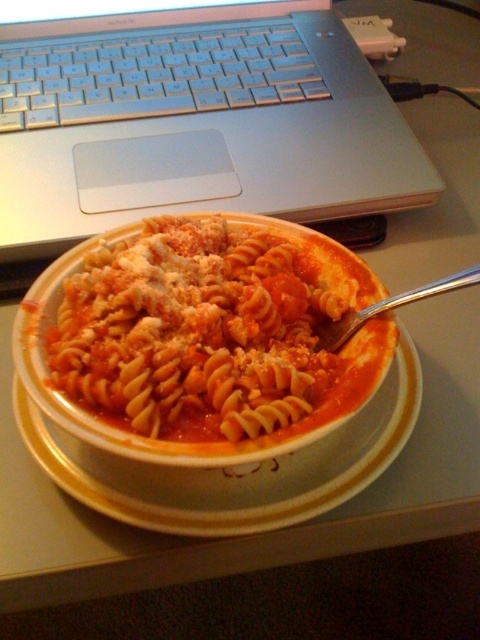
Between matte tomato sauce pasta at center and white ceramic bowl at center, which one appears on the left side from the viewer's perspective?

Positioned to the left is matte tomato sauce pasta at center.

Between point (107, 410) and point (365, 419), which one is positioned behind?

Point (365, 419)

Where is `matte tomato sauce pasta at center`? The height and width of the screenshot is (640, 480). matte tomato sauce pasta at center is located at coordinates (214, 332).

Is silver metallic laptop at upper left to the left of white ceramic bowl at center from the viewer's perspective?

Indeed, silver metallic laptop at upper left is positioned on the left side of white ceramic bowl at center.

What do you see at coordinates (194, 122) in the screenshot?
I see `silver metallic laptop at upper left` at bounding box center [194, 122].

Where is `silver metallic laptop at upper left`? This screenshot has height=640, width=480. silver metallic laptop at upper left is located at coordinates (194, 122).

Describe the element at coordinates (194, 122) in the screenshot. I see `silver metallic laptop at upper left` at that location.

Between silver metallic laptop at upper left and silver metallic fork at upper center, which one is positioned higher?

silver metallic laptop at upper left is above.

Who is more forward, [128,84] or [348,339]?

Point [348,339] is more forward.

Image resolution: width=480 pixels, height=640 pixels. Identify the location of silver metallic laptop at upper left. click(194, 122).